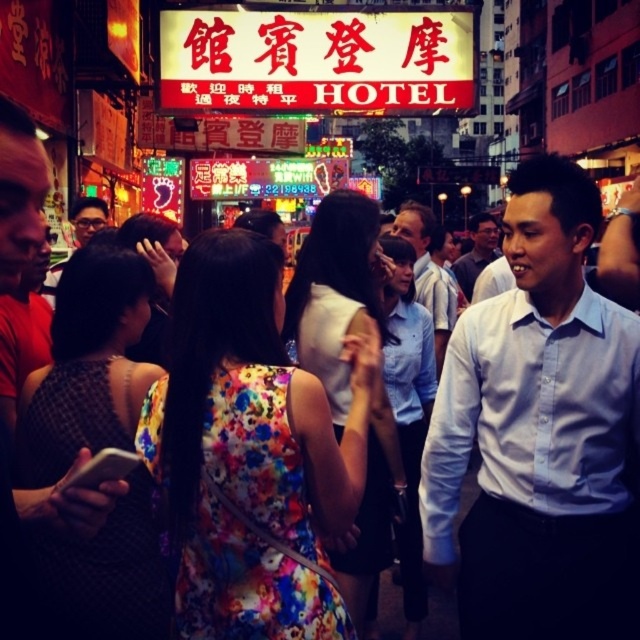
Question: Does red plastic sign at upper center appear over light blue shirt at center?

Choices:
 (A) no
 (B) yes

Answer: (B)

Question: Among these objects, which one is nearest to the camera?

Choices:
 (A) light blue shirt at center
 (B) red plastic sign at upper center
 (C) matte white shirt at center

Answer: (B)

Question: Which of the following is the closest to the observer?

Choices:
 (A) white cotton shirt at center
 (B) red plastic sign at upper center

Answer: (A)

Question: Which object is positioned closest to the white cotton shirt at center?

Choices:
 (A) red plastic sign at upper center
 (B) light blue shirt at center

Answer: (B)

Question: Is red plastic sign at upper center to the left of matte white shirt at center from the viewer's perspective?

Choices:
 (A) yes
 (B) no

Answer: (A)

Question: Can you confirm if red plastic sign at upper center is positioned to the left of light blue shirt at center?

Choices:
 (A) yes
 (B) no

Answer: (A)